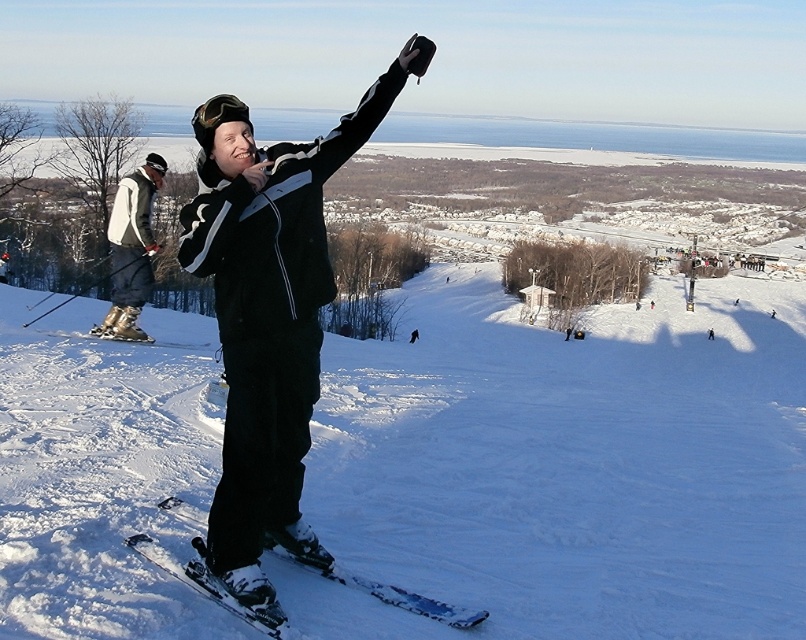
Can you confirm if shiny metallic skis at center is thinner than brushed metal ski pole at left?

Indeed, shiny metallic skis at center has a lesser width compared to brushed metal ski pole at left.

Between point (244, 620) and point (123, 180), which one is positioned behind?

The point (123, 180) is behind.

Locate an element on the screen. The height and width of the screenshot is (640, 806). shiny metallic skis at center is located at coordinates (389, 593).

Can you confirm if matte black snowboard at center is shorter than brushed metal ski pole at left?

Yes, matte black snowboard at center is shorter than brushed metal ski pole at left.

Which of these two, matte black snowboard at center or brushed metal ski pole at left, stands shorter?

Standing shorter between the two is matte black snowboard at center.

Does point (273, 481) lie in front of point (119, 243)?

Yes, it is in front of point (119, 243).

You are a GUI agent. You are given a task and a screenshot of the screen. Output one action in this format:
    pyautogui.click(x=<x>, y=<y>)
    Task: Click on the matte black snowboard at center
    
    Given the screenshot: What is the action you would take?
    pyautogui.click(x=268, y=316)

Image resolution: width=806 pixels, height=640 pixels. Describe the element at coordinates (268, 316) in the screenshot. I see `matte black snowboard at center` at that location.

Does matte black snowboard at center appear over shiny metallic skis at center?

Indeed, matte black snowboard at center is positioned over shiny metallic skis at center.

Which is behind, point (339, 163) or point (393, 588)?

The point (393, 588) is behind.

At what (x,y) coordinates should I click in order to perform the action: click on matte black snowboard at center. Please return your answer as a coordinate pair (x, y). Looking at the image, I should click on (268, 316).